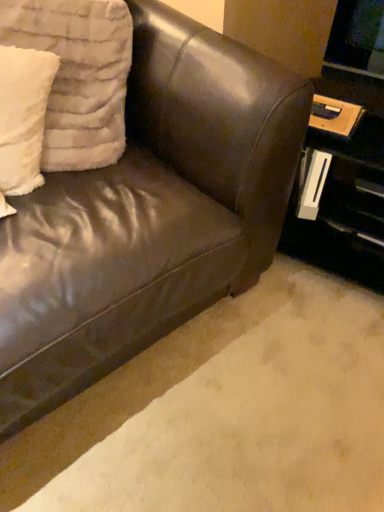
Question: Is brown leather couch at lower left in front of or behind matte black table at right in the image?

Choices:
 (A) behind
 (B) front

Answer: (B)

Question: From the image's perspective, relative to matte black table at right, is brown leather couch at lower left above or below?

Choices:
 (A) above
 (B) below

Answer: (B)

Question: Which of these objects is positioned farthest from the brown leather couch at lower left?

Choices:
 (A) white fluffy pillow at upper left, the 2th pillow viewed from the right
 (B) brown leather couch at upper left
 (C) matte black table at right
 (D) white fluffy pillow at upper left, which is the first pillow in right-to-left order

Answer: (A)

Question: Which is nearer to the white fluffy pillow at upper left, the 2th pillow viewed from the right?

Choices:
 (A) brown leather couch at upper left
 (B) matte black table at right
 (C) brown leather couch at lower left
 (D) white fluffy pillow at upper left, acting as the second pillow starting from the left

Answer: (D)